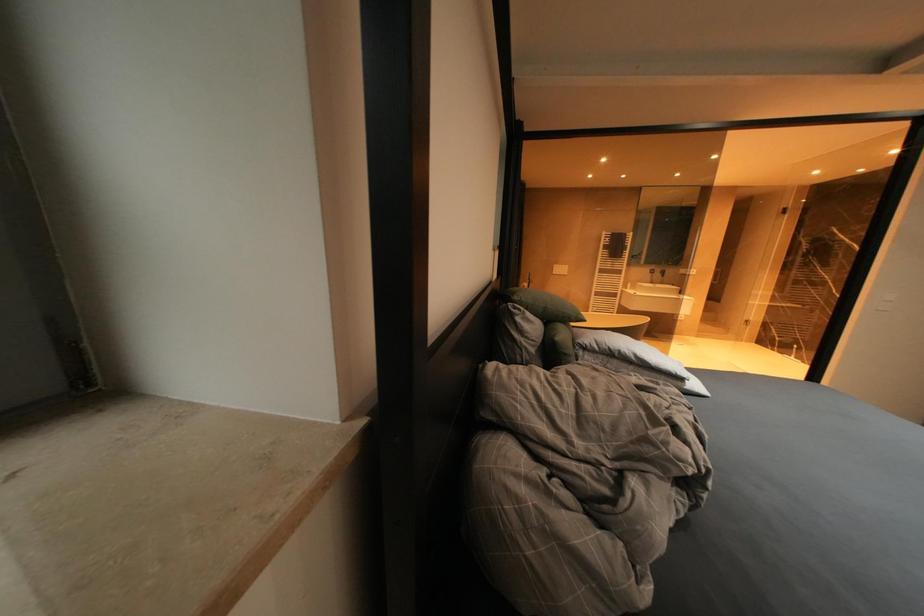
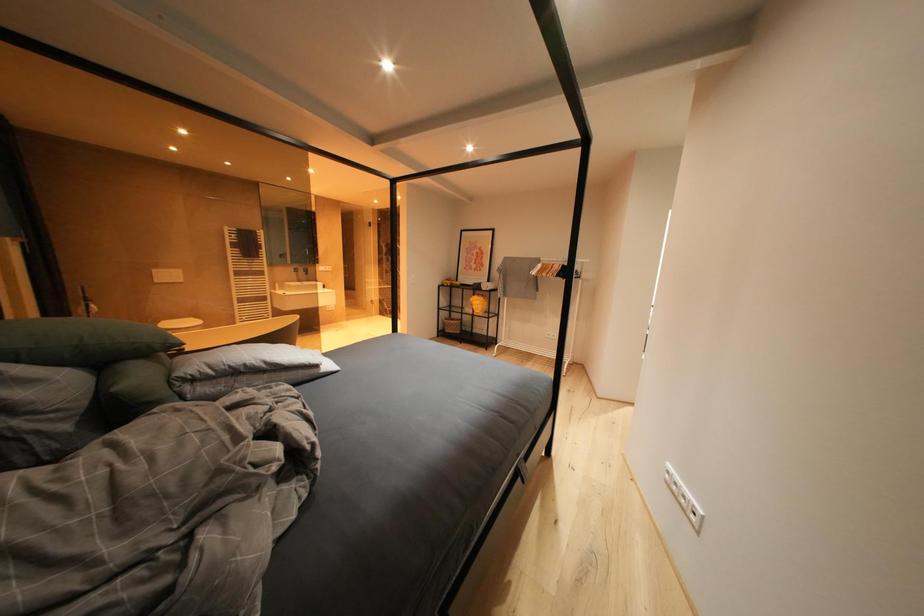
Question: The camera is either moving clockwise (left) or counter-clockwise (right) around the object. The first image is from the beginning of the video and the second image is from the end. Is the camera moving left or right when shooting the video?

Choices:
 (A) Left
 (B) Right

Answer: (A)